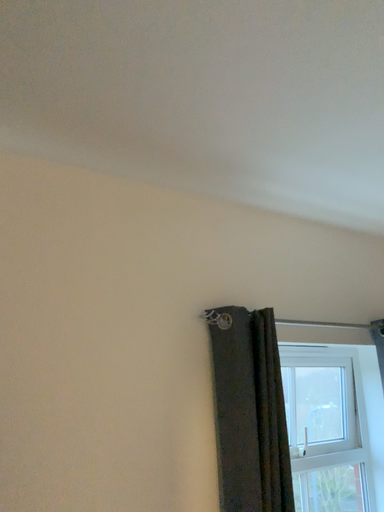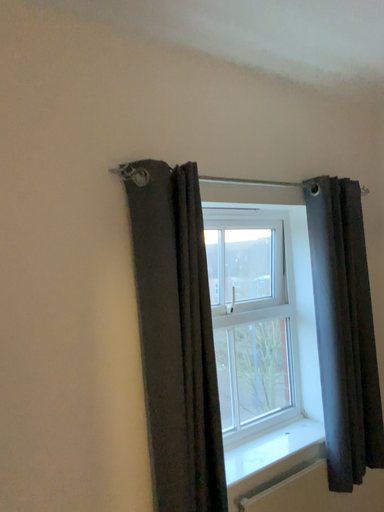
Question: How did the camera likely rotate when shooting the video?

Choices:
 (A) rotated right
 (B) rotated left

Answer: (A)